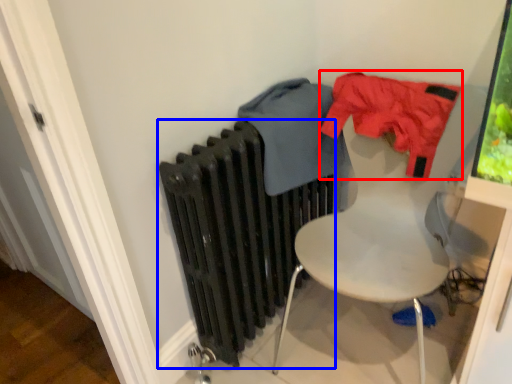
Question: Which object appears closest to the camera in this image, clothing (highlighted by a red box) or radiator (highlighted by a blue box)?

Choices:
 (A) clothing
 (B) radiator

Answer: (B)